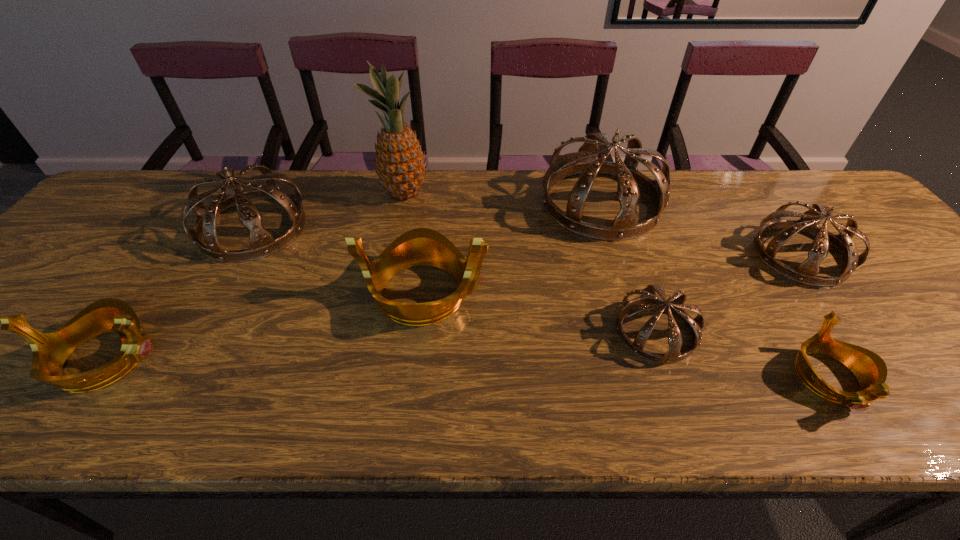
Locate an element on the screen. This screenshot has width=960, height=540. blank space at the far edge is located at coordinates (700, 195).

You are a GUI agent. You are given a task and a screenshot of the screen. Output one action in this format:
    pyautogui.click(x=<x>, y=<y>)
    Task: Click on the blank area at the near edge
    The image size is (960, 540).
    Given the screenshot: What is the action you would take?
    pyautogui.click(x=232, y=404)

The width and height of the screenshot is (960, 540). In the image, there is a desktop. In order to click on blank space at the left edge in this screenshot , I will do `click(64, 298)`.

In the image, there is a desktop. Identify the location of vacant space at the right edge. This screenshot has width=960, height=540. (916, 338).

The image size is (960, 540). In the image, there is a desktop. In order to click on vacant region at the far left corner in this screenshot , I will do click(x=136, y=217).

This screenshot has height=540, width=960. I want to click on unoccupied position between the second smallest brown tiara and the leftmost brown tiara, so click(x=527, y=241).

Where is `empty location between the rightmost brown tiara and the shortest tiara`? empty location between the rightmost brown tiara and the shortest tiara is located at coordinates (815, 316).

Identify the location of unoccupied position between the rightmost brown tiara and the third smallest brown tiara. The height and width of the screenshot is (540, 960). (527, 241).

Identify the location of blank region between the rightmost brown tiara and the third smallest brown tiara. (527, 241).

At what (x,y) coordinates should I click in order to perform the action: click on vacant point located between the second biggest gold tiara and the third smallest brown tiara. Please return your answer as a coordinate pair (x, y). Image resolution: width=960 pixels, height=540 pixels. Looking at the image, I should click on (180, 293).